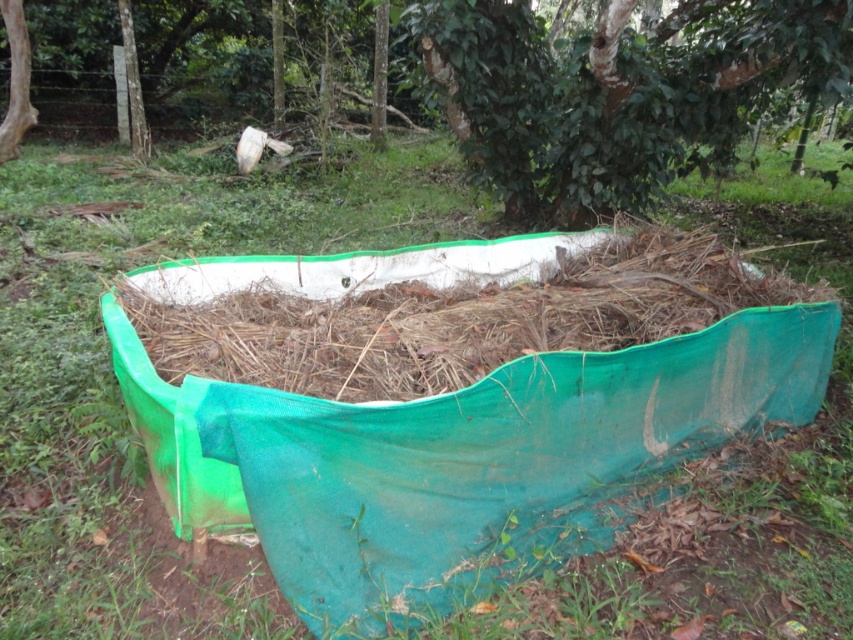
Question: Does green leafy tree at upper center come behind green fabric hay at center?

Choices:
 (A) no
 (B) yes

Answer: (B)

Question: Which point is farther to the camera?

Choices:
 (A) green leafy tree at upper center
 (B) green fabric hay at center

Answer: (A)

Question: In this image, where is green leafy tree at upper center located relative to green fabric hay at center?

Choices:
 (A) right
 (B) left

Answer: (A)

Question: Where is green leafy tree at upper center located in relation to green fabric hay at center in the image?

Choices:
 (A) left
 (B) right

Answer: (B)

Question: Among these objects, which one is nearest to the camera?

Choices:
 (A) green fabric hay at center
 (B) green leafy tree at upper center

Answer: (A)